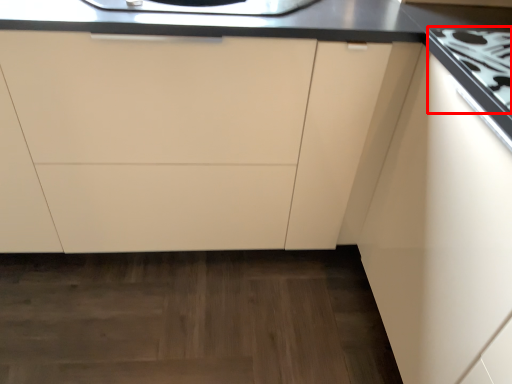
Question: Observing the image, what is the correct spatial positioning of gas stove (annotated by the red box) in reference to cabinetry?

Choices:
 (A) right
 (B) left

Answer: (A)